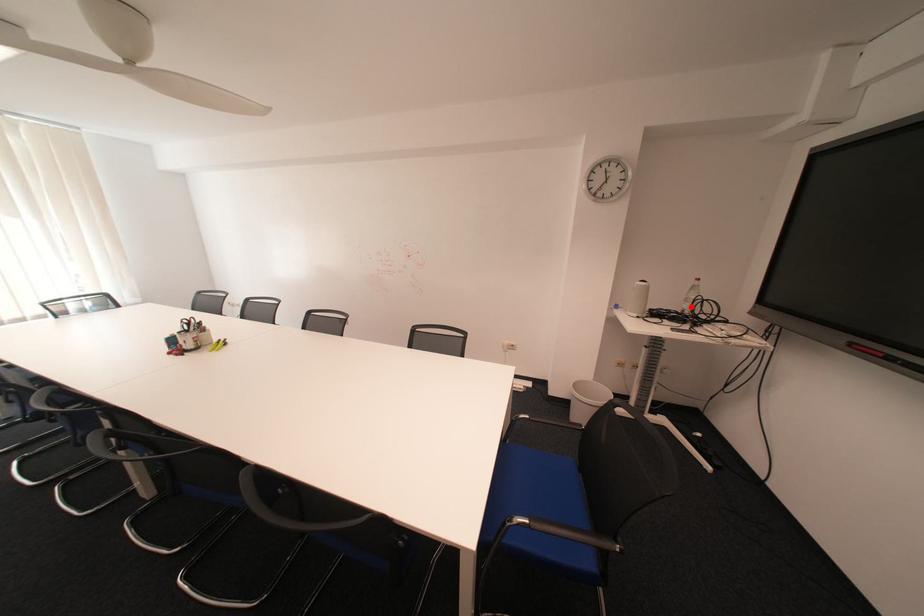
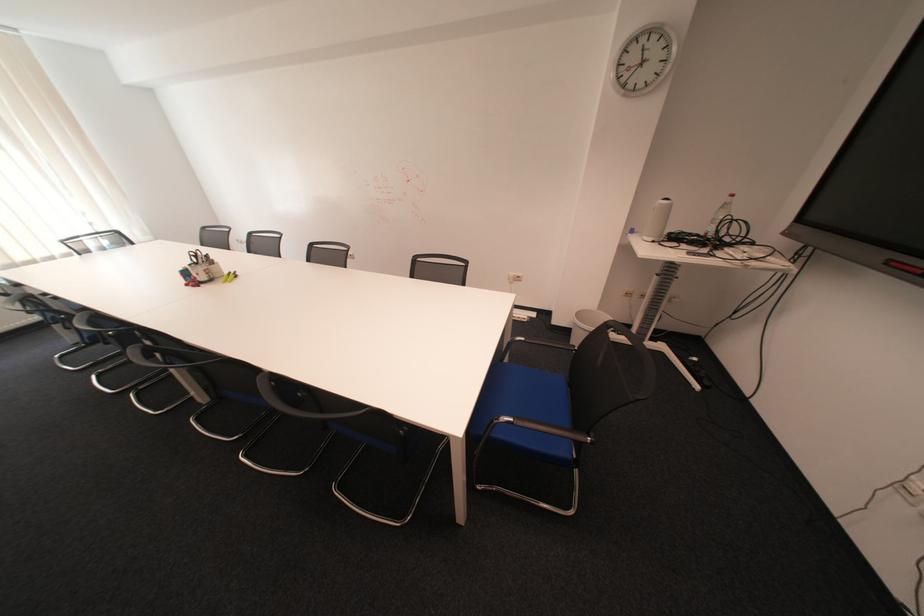
In the second image, find the point that corresponds to the highlighted location in the first image.

(714, 229)